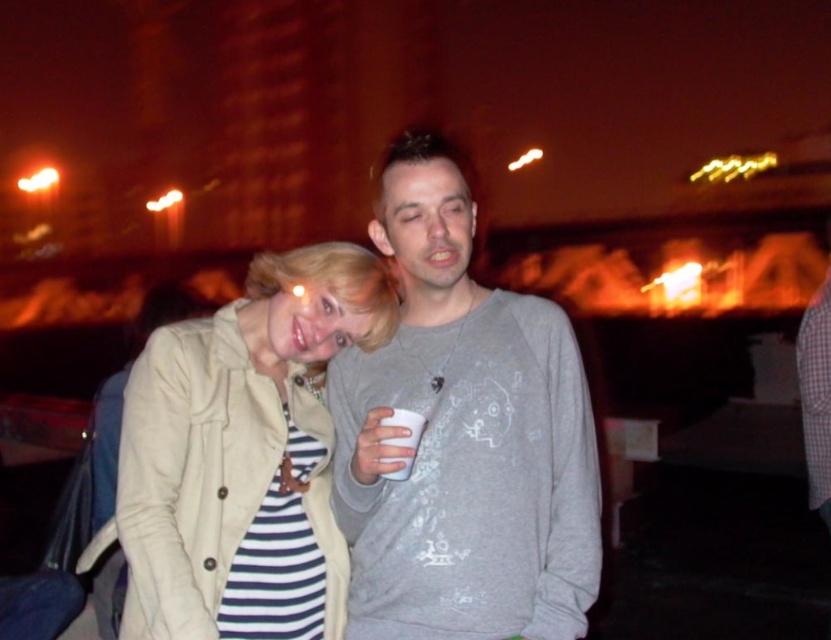
Question: Which object appears closest to the camera in this image?

Choices:
 (A) white paper cup at center
 (B) beige fabric jacket at center
 (C) gray cotton sweatshirt at center

Answer: (A)

Question: Observing the image, what is the correct spatial positioning of gray cotton sweatshirt at center in reference to beige fabric jacket at center?

Choices:
 (A) right
 (B) left

Answer: (A)

Question: Estimate the real-world distances between objects in this image. Which object is closer to the gray cotton sweatshirt at center?

Choices:
 (A) white paper cup at center
 (B) beige fabric jacket at center

Answer: (B)

Question: Which object is closer to the camera taking this photo?

Choices:
 (A) beige fabric jacket at center
 (B) gray cotton sweatshirt at center
 (C) white paper cup at center

Answer: (C)

Question: Is gray cotton sweatshirt at center positioned behind white paper cup at center?

Choices:
 (A) no
 (B) yes

Answer: (B)

Question: Is gray cotton sweatshirt at center bigger than white paper cup at center?

Choices:
 (A) yes
 (B) no

Answer: (A)